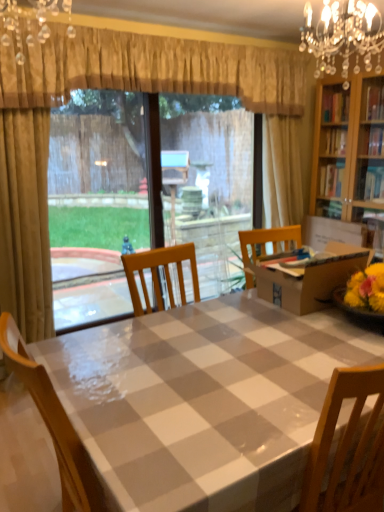
Question: Considering the positions of point (178, 104) and point (331, 10), is point (178, 104) closer or farther from the camera than point (331, 10)?

Choices:
 (A) farther
 (B) closer

Answer: (A)

Question: Relative to crystal chandelier at upper right, which is the 2th light fixture from left to right, is clear plastic window screen at center in front or behind?

Choices:
 (A) behind
 (B) front

Answer: (A)

Question: Estimate the real-world distances between objects in this image. Which object is closer to the checkered plastic table at center?

Choices:
 (A) crystal chandelier at upper right, the second light fixture positioned from the front
 (B) clear plastic window screen at center
 (C) gold textured curtain at upper center
 (D) crystal glass chandelier at upper center, placed as the 2th light fixture when sorted from right to left

Answer: (A)

Question: Which object is the farthest from the clear plastic window screen at center?

Choices:
 (A) crystal chandelier at upper right, which is the 2th light fixture from left to right
 (B) gold textured curtain at upper center
 (C) crystal glass chandelier at upper center, placed as the 1th light fixture when sorted from front to back
 (D) checkered plastic table at center

Answer: (D)